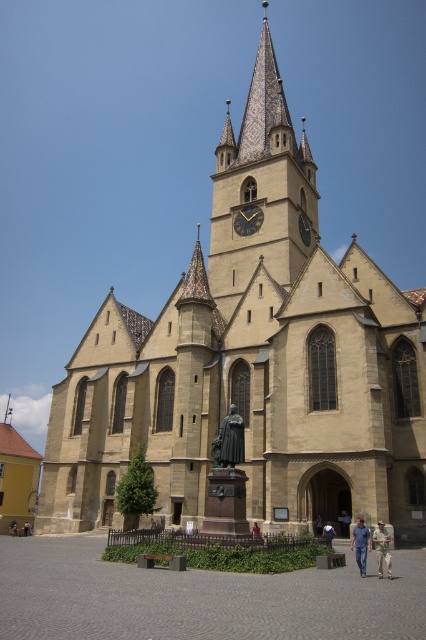
Question: Is light blue fabric shirt at lower center to the right of brown wooden statue at center from the viewer's perspective?

Choices:
 (A) yes
 (B) no

Answer: (A)

Question: Can you confirm if gold metallic clock at center is positioned below dark brown wooden statue at center?

Choices:
 (A) yes
 (B) no

Answer: (B)

Question: Which object is farther from the camera taking this photo?

Choices:
 (A) camouflage fabric jacket at lower right
 (B) light brown wooden statue at center
 (C) gold metallic clock at center
 (D) light blue fabric shirt at lower center

Answer: (C)

Question: Which of the following is the closest to the observer?

Choices:
 (A) brown wooden statue at center
 (B) light brown wooden statue at center

Answer: (A)

Question: Estimate the real-world distances between objects in this image. Which object is closer to the beige stone clock tower at center?

Choices:
 (A) camouflage fabric jacket at lower right
 (B) light blue fabric shirt at lower center
 (C) gold metallic clock at center
 (D) light brown wooden statue at center

Answer: (C)

Question: Does camouflage fabric jacket at lower right have a larger size compared to brown wooden statue at center?

Choices:
 (A) no
 (B) yes

Answer: (B)